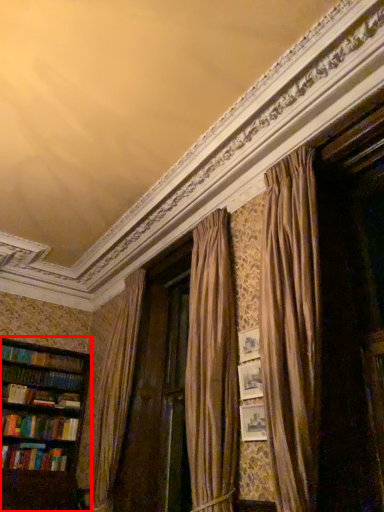
Question: From the image's perspective, where is bookcase (annotated by the red box) located relative to book?

Choices:
 (A) below
 (B) above

Answer: (B)